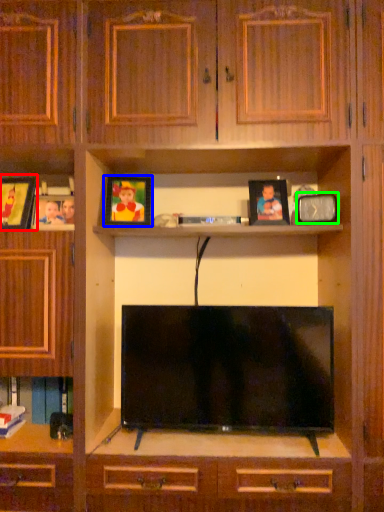
Question: Which object is the closest to the picture frame (highlighted by a red box)? Choose among these: picture frame (highlighted by a blue box) or picture frame (highlighted by a green box).

Choices:
 (A) picture frame
 (B) picture frame

Answer: (A)